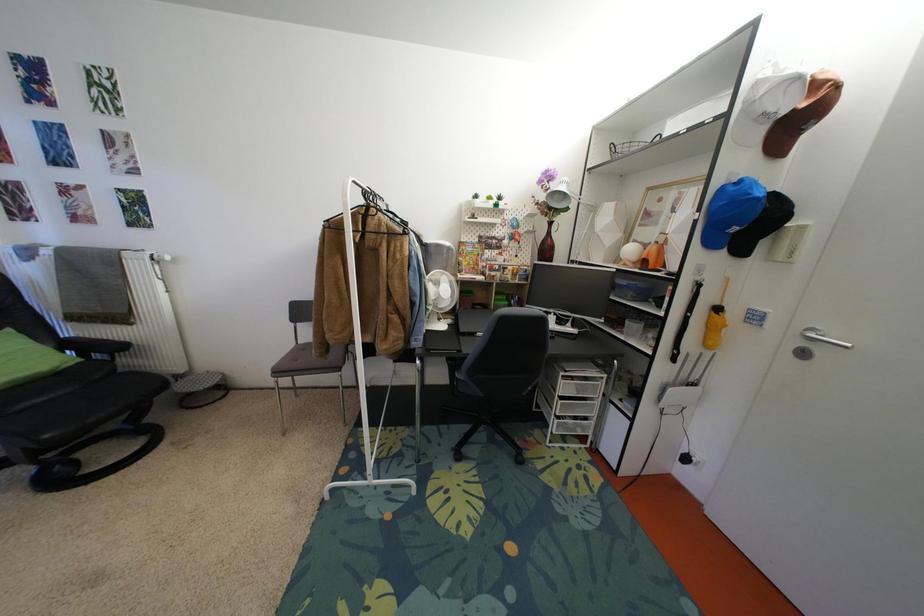
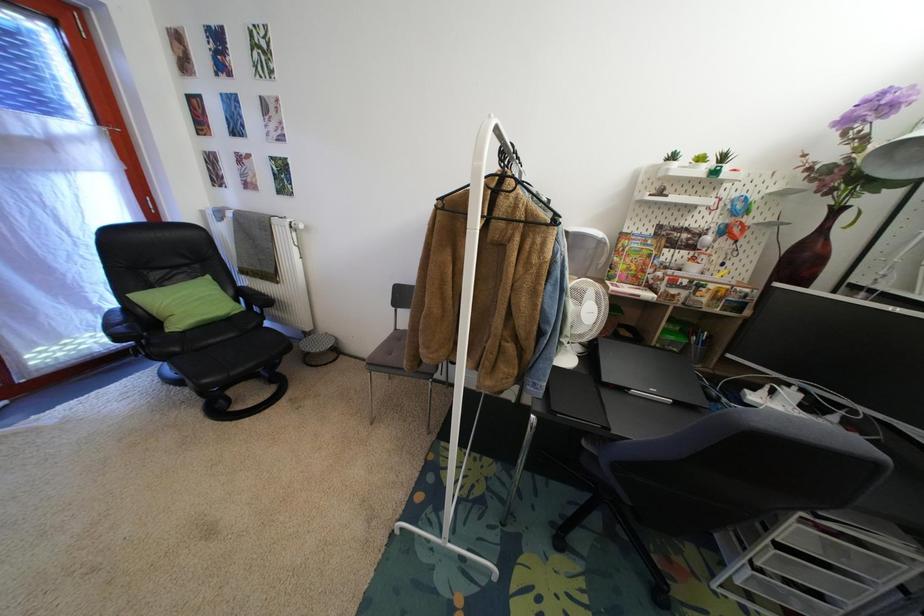
Question: The images are taken continuously from a first-person perspective. In which direction is your viewpoint rotating?

Choices:
 (A) Left
 (B) Right
 (C) Up
 (D) Down

Answer: (A)